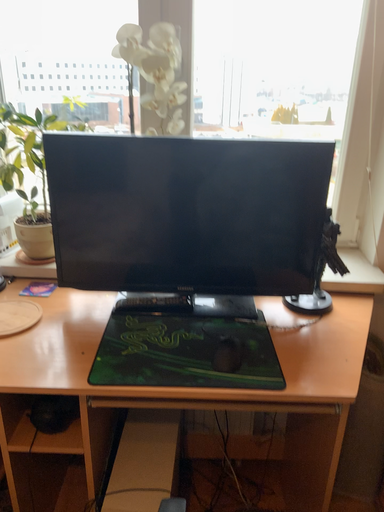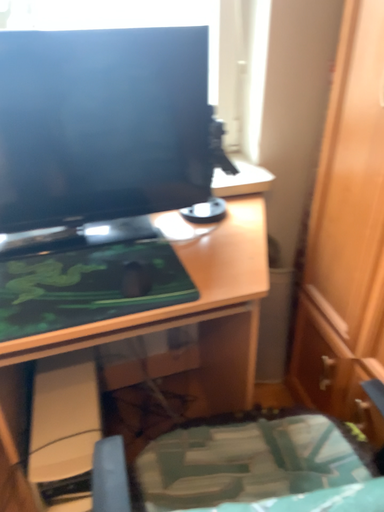
Question: How did the camera likely rotate when shooting the video?

Choices:
 (A) rotated right
 (B) rotated left

Answer: (A)